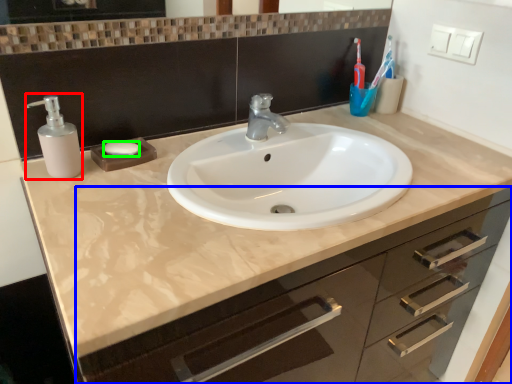
Question: Based on their relative distances, which object is farther from soap dispenser (highlighted by a red box)? Choose from bathroom cabinet (highlighted by a blue box) and soap (highlighted by a green box).

Choices:
 (A) bathroom cabinet
 (B) soap

Answer: (A)